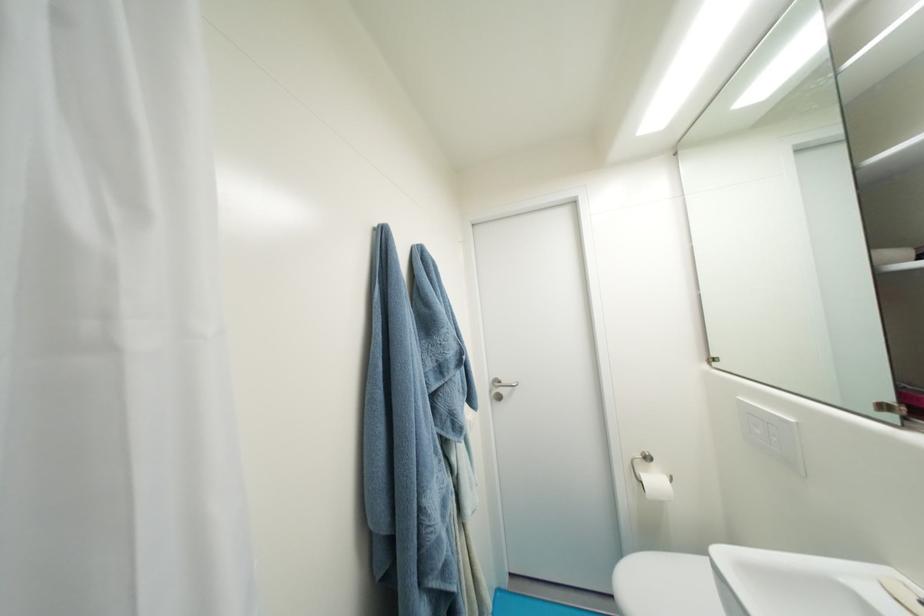
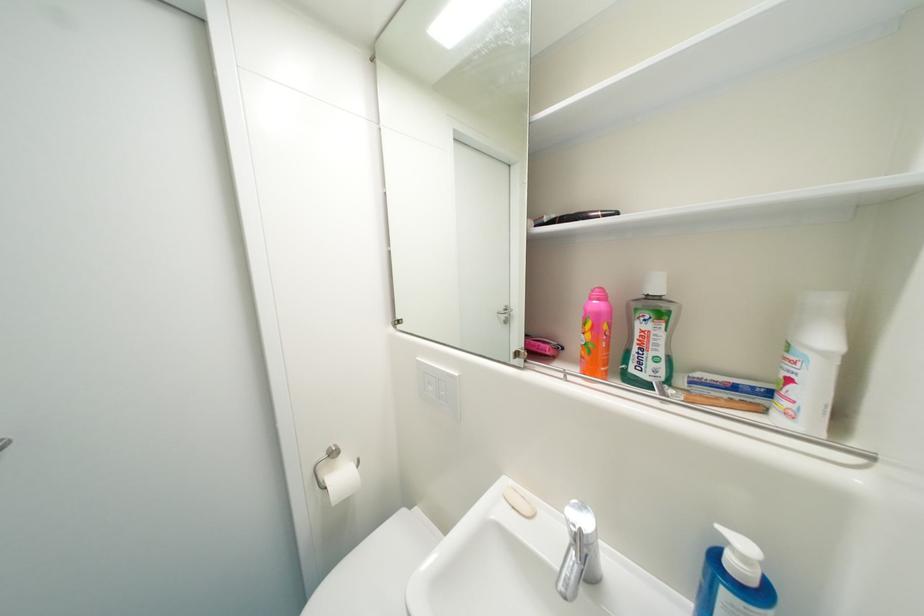
Question: Based on the continuous images, in which direction is the camera rotating? Reply with the corresponding letter.

Choices:
 (A) Left
 (B) Right
 (C) Up
 (D) Down

Answer: (B)